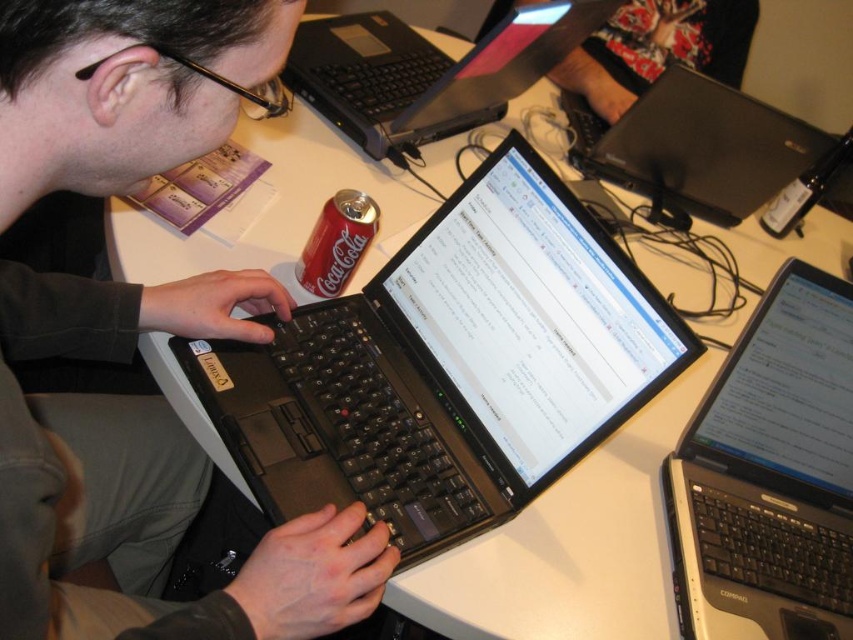
You are a person sitting at the workspace described. You need to reach for the black matte laptop at center to continue your work. Is the floral fabric skirt at upper center blocking your access to the laptop?

The black matte laptop at center is in front of the floral fabric skirt at upper center, so the skirt is behind the laptop and not blocking your access.

You are a photographer trying to capture the black plastic laptop at center and the floral fabric skirt at upper center in the same frame. Based on their positions, which object should you focus on first to ensure both are in the frame?

The black plastic laptop at center is located below the floral fabric skirt at upper center, so you should focus on the floral fabric skirt at upper center first to ensure both are in the frame.

Based on the photo, you are organizing a desk space and need to place both the black matte laptop at upper center and the floral fabric skirt at upper center on a shelf. Given their sizes, which item should be placed first to ensure both fit properly?

The black matte laptop at upper center should be placed first because it is smaller than the floral fabric skirt at upper center, allowing enough space for both items on the shelf.